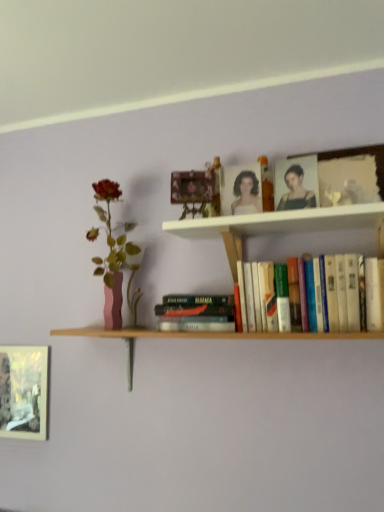
What are the coordinates of `vacant region to the left of matte black portrait at upper center` in the screenshot? It's located at (249, 221).